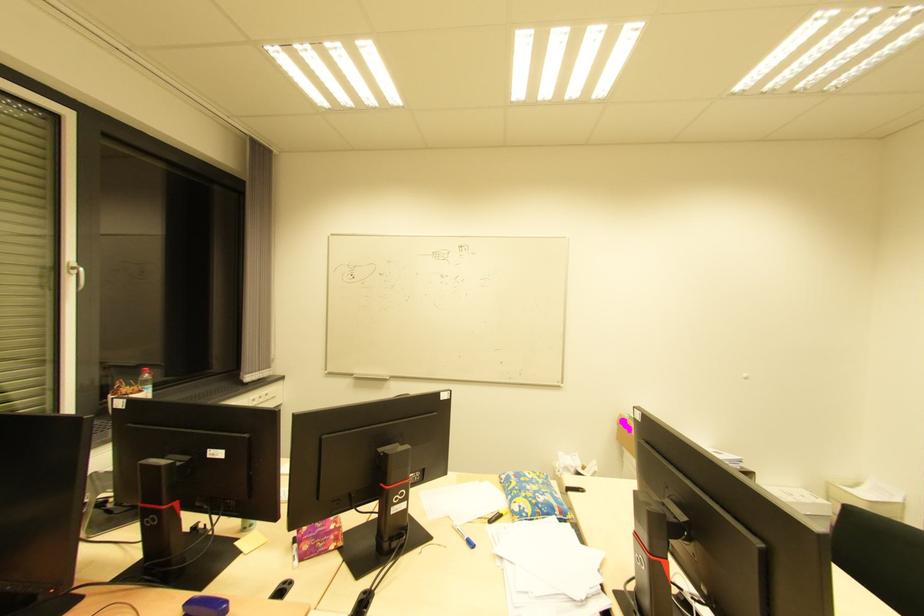
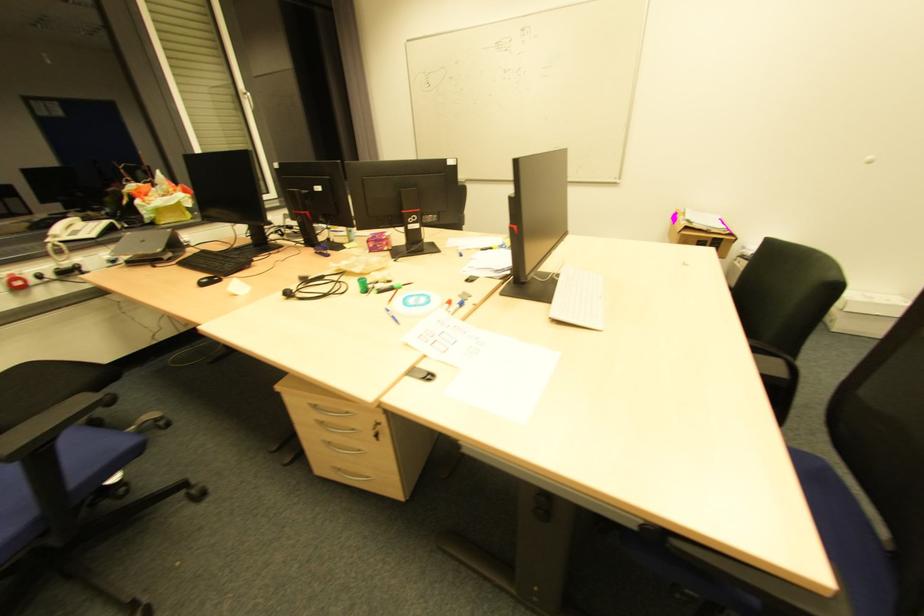
Based on the continuous images, in which direction is the camera rotating?

The rotation direction of the camera is left-down.